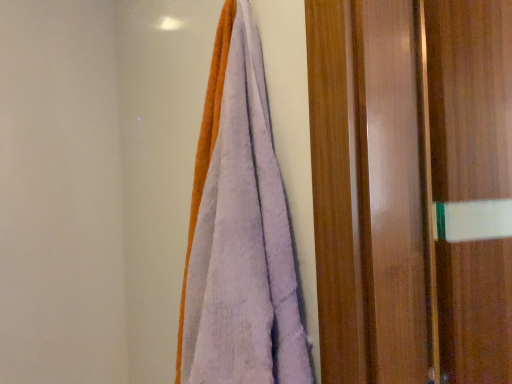
Image resolution: width=512 pixels, height=384 pixels. Describe the element at coordinates (240, 229) in the screenshot. I see `orange cotton towel at center` at that location.

At what (x,y) coordinates should I click in order to perform the action: click on orange cotton towel at center. Please return your answer as a coordinate pair (x, y). Looking at the image, I should click on click(x=240, y=229).

Image resolution: width=512 pixels, height=384 pixels. In order to click on orange cotton towel at center in this screenshot , I will do `click(240, 229)`.